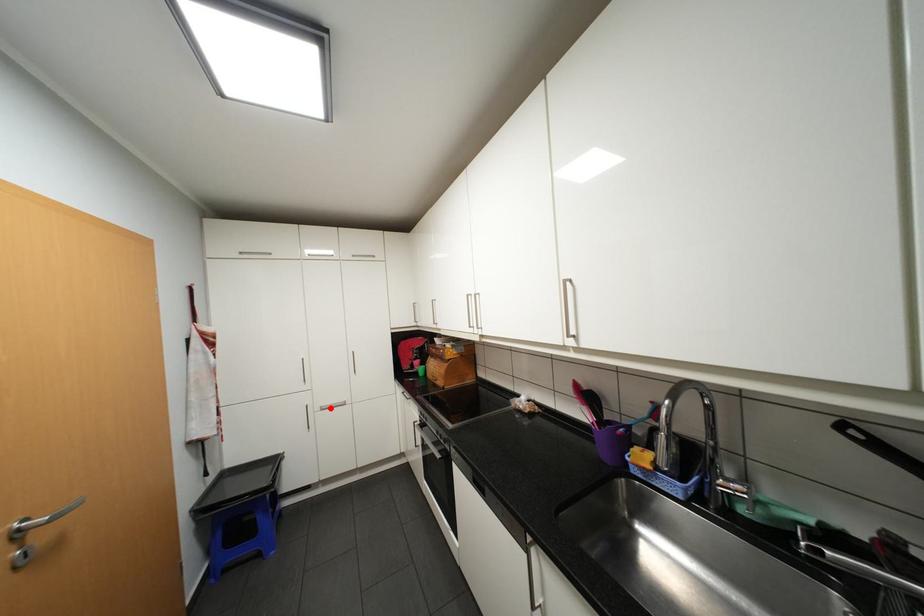
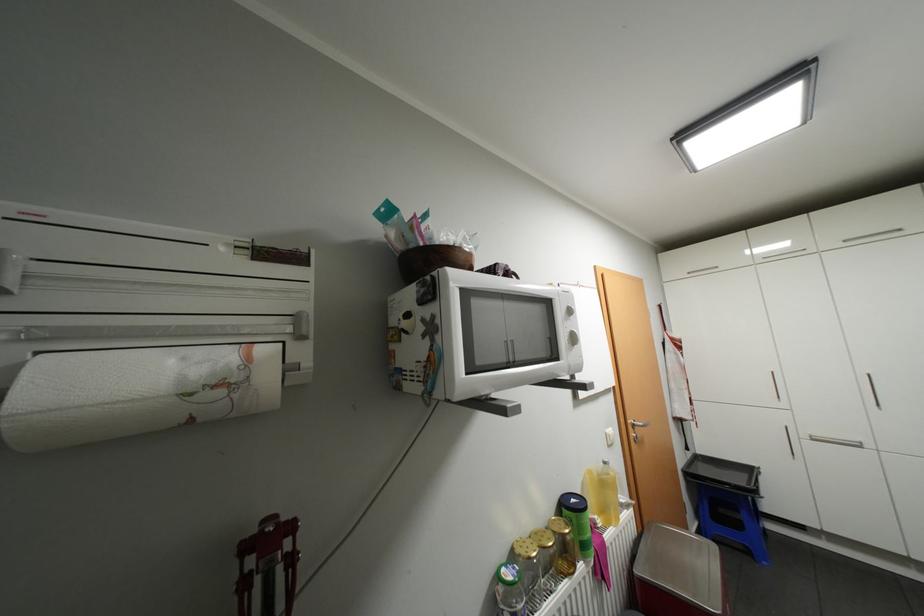
Question: I am providing you with two images of the same scene from different viewpoints. A red point is shown in image1. For the corresponding object point in image2, is it positioned nearer or farther from the camera?

Choices:
 (A) Nearer
 (B) Farther

Answer: (B)